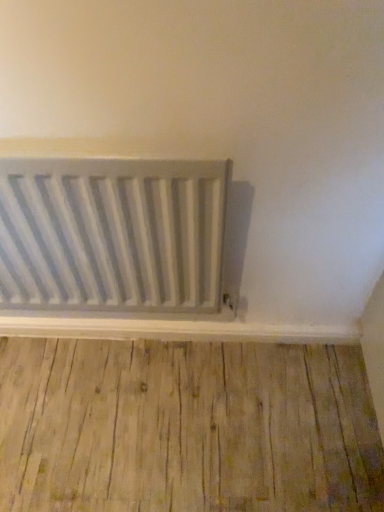
Question: Considering the relative sizes of light brown wood flooring at lower center and white matte radiator at center in the image provided, is light brown wood flooring at lower center thinner than white matte radiator at center?

Choices:
 (A) no
 (B) yes

Answer: (A)

Question: From the image's perspective, does light brown wood flooring at lower center appear higher than white matte radiator at center?

Choices:
 (A) no
 (B) yes

Answer: (A)

Question: From a real-world perspective, is light brown wood flooring at lower center on white matte radiator at center?

Choices:
 (A) yes
 (B) no

Answer: (B)

Question: From a real-world perspective, is light brown wood flooring at lower center positioned under white matte radiator at center based on gravity?

Choices:
 (A) no
 (B) yes

Answer: (B)

Question: Can you confirm if light brown wood flooring at lower center is shorter than white matte radiator at center?

Choices:
 (A) no
 (B) yes

Answer: (B)

Question: Are light brown wood flooring at lower center and white matte radiator at center located far from each other?

Choices:
 (A) no
 (B) yes

Answer: (A)

Question: Is light brown wood flooring at lower center at the back of white matte radiator at center?

Choices:
 (A) no
 (B) yes

Answer: (A)

Question: Is the position of white matte radiator at center more distant than that of light brown wood flooring at lower center?

Choices:
 (A) yes
 (B) no

Answer: (B)

Question: Is white matte radiator at center not close to light brown wood flooring at lower center?

Choices:
 (A) yes
 (B) no

Answer: (B)

Question: From a real-world perspective, does white matte radiator at center sit lower than light brown wood flooring at lower center?

Choices:
 (A) no
 (B) yes

Answer: (A)

Question: Is white matte radiator at center in contact with light brown wood flooring at lower center?

Choices:
 (A) no
 (B) yes

Answer: (A)

Question: Can light brown wood flooring at lower center be found inside white matte radiator at center?

Choices:
 (A) yes
 (B) no

Answer: (B)

Question: From a real-world perspective, is light brown wood flooring at lower center positioned above or below white matte radiator at center?

Choices:
 (A) above
 (B) below

Answer: (B)